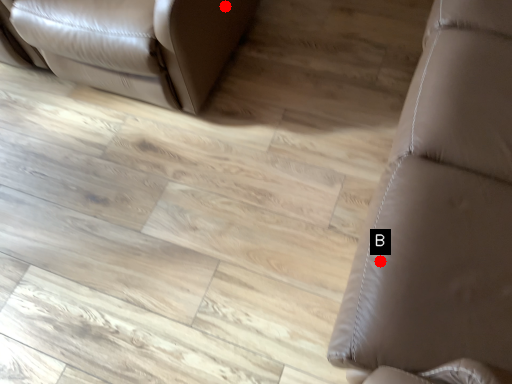
Question: Two points are circled on the image, labeled by A and B beside each circle. Which point is farther from the camera taking this photo?

Choices:
 (A) A is further
 (B) B is further

Answer: (A)